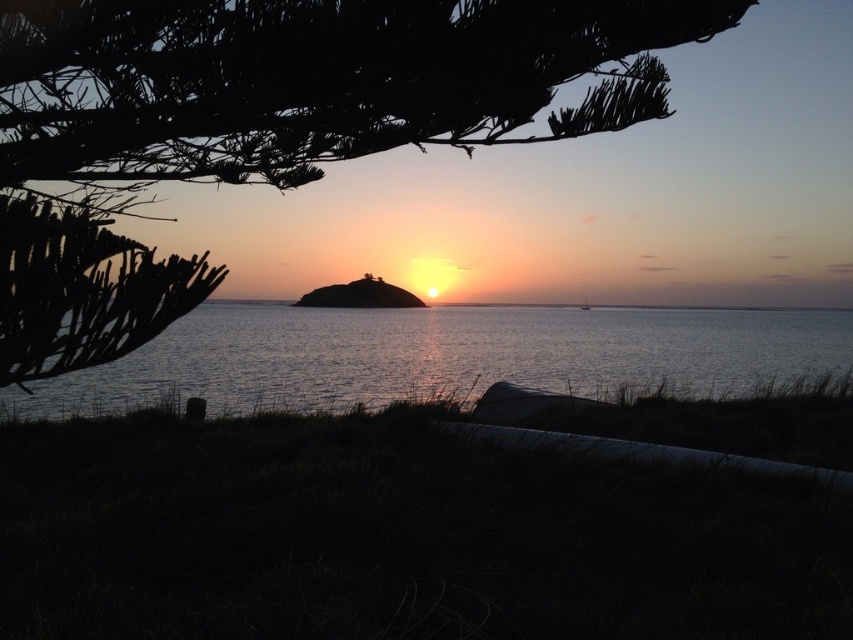
Question: Estimate the real-world distances between objects in this image. Which object is closer to the green leafy tree at upper left?

Choices:
 (A) glistening silver water at center
 (B) white glossy boat at center

Answer: (A)

Question: Can you confirm if green leafy tree at upper left is smaller than glistening silver water at center?

Choices:
 (A) no
 (B) yes

Answer: (B)

Question: Which of the following is the closest to the observer?

Choices:
 (A) glistening silver water at center
 (B) white glossy boat at center
 (C) green leafy tree at upper left

Answer: (C)

Question: Can you confirm if glistening silver water at center is positioned below white glossy boat at center?

Choices:
 (A) yes
 (B) no

Answer: (A)

Question: Can you confirm if glistening silver water at center is thinner than white glossy boat at center?

Choices:
 (A) no
 (B) yes

Answer: (A)

Question: Among these points, which one is nearest to the camera?

Choices:
 (A) (608, 42)
 (B) (583, 298)
 (C) (519, 380)

Answer: (A)